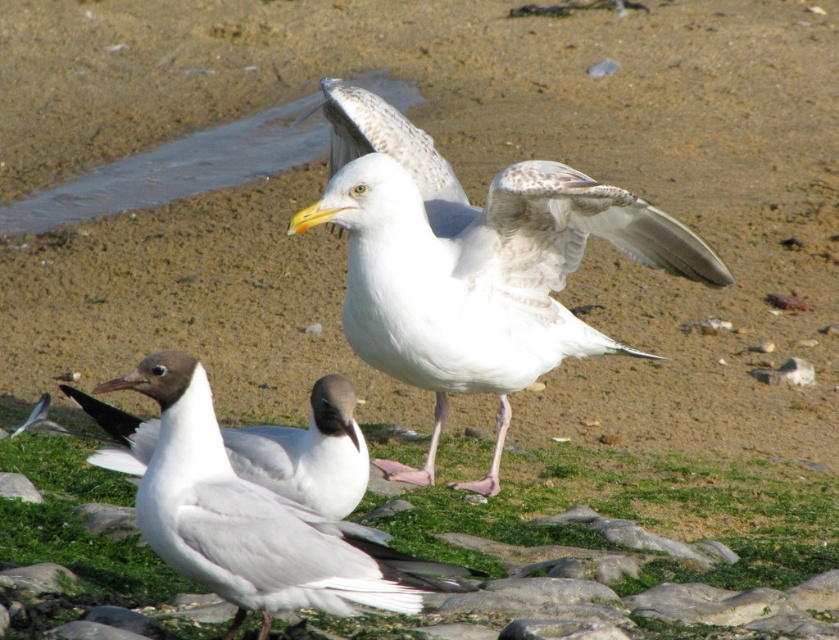
You are a photographer trying to capture the white feathered bird at center and the green grass at center in a single shot. Based on their positions, which object is positioned to the left side of the other?

The white feathered bird at center is to the left of green grass at center.

You are standing at the shoreline looking at the two points marked in the image. Which point, point (392, 243) or point (517, 483), is closer to you?

Point (392, 243) is closer to you because it is in front of point (517, 483).